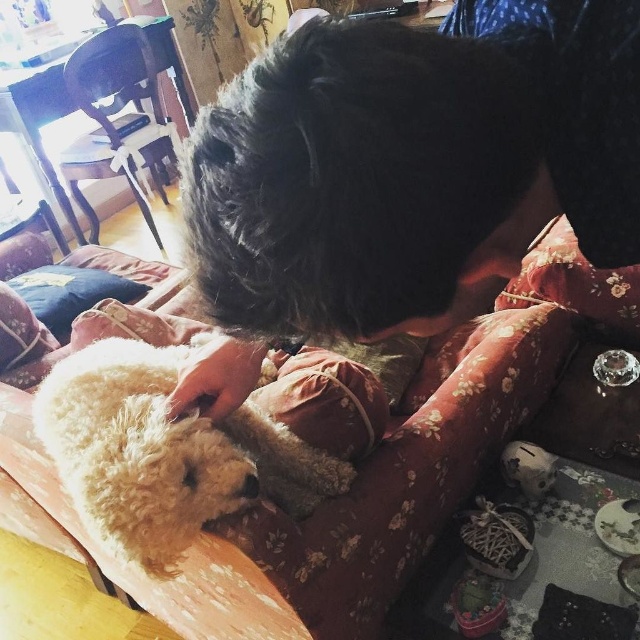
Based on the photo, you are a small cat trying to jump from the fluffy fabric pillow at lower left to the floral fabric couch at center. Can you make the jump if your maximum jump distance is 70 centimeters?

The distance between the fluffy fabric pillow at lower left and the floral fabric couch at center is 74.73 centimeters, which is greater than your maximum jump distance of 70 centimeters. Therefore, you cannot make the jump.

You need to place a rectangular pillow that is 1.2 meters wide on the floral fabric couch at center. The white fluffy dog at center is currently lying on the couch. Can the pillow fit on the couch without displacing the dog?

The floral fabric couch at center might be wider than white fluffy dog at center, so there is a possibility that the pillow could fit if the couch has enough space beyond where the dog is lying. However, since the exact dimensions of the couch aren